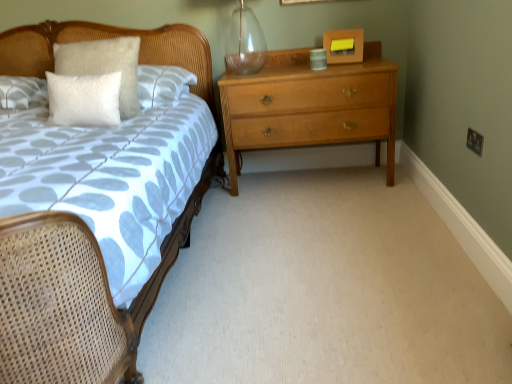
I want to click on free spot in front of light brown wood chest of drawers at center, so click(321, 222).